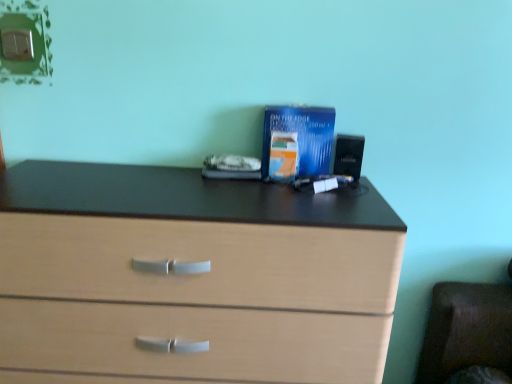
Identify the location of vacant space situated on the left part of blue glossy paperback book at center, which is the 2th paperback book from back to front. The width and height of the screenshot is (512, 384). (224, 187).